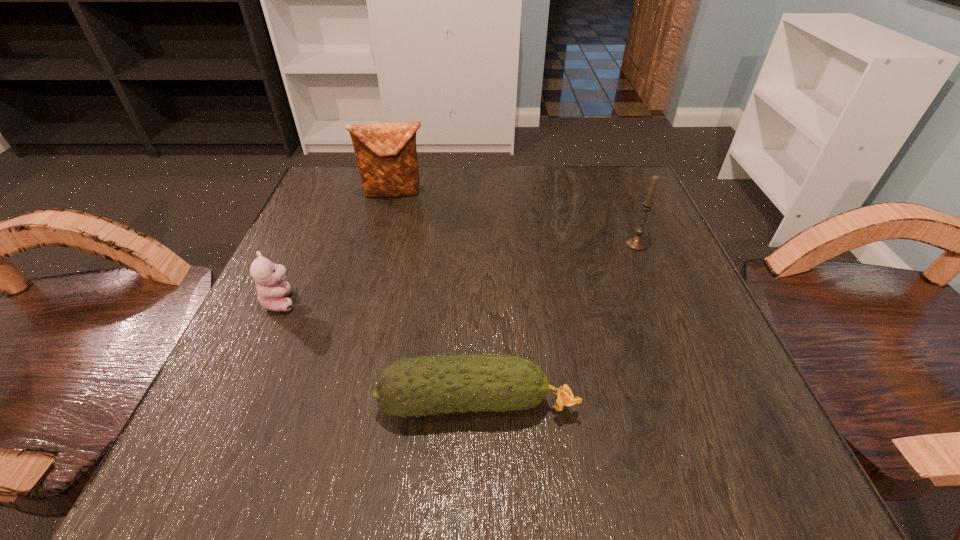
Locate an element on the screen. The width and height of the screenshot is (960, 540). clutch bag is located at coordinates (386, 154).

You are a GUI agent. You are given a task and a screenshot of the screen. Output one action in this format:
    pyautogui.click(x=<x>, y=<y>)
    Task: Click on the candle
    The image size is (960, 540).
    Given the screenshot: What is the action you would take?
    pyautogui.click(x=637, y=242)

Locate an element on the screen. the rightmost object is located at coordinates (637, 242).

Identify the location of the third farthest object. This screenshot has width=960, height=540. (269, 278).

At what (x,y) coordinates should I click in order to perform the action: click on the leftmost object. Please return your answer as a coordinate pair (x, y). Looking at the image, I should click on (269, 278).

Where is `the shortest object`? The width and height of the screenshot is (960, 540). the shortest object is located at coordinates (424, 385).

What are the coordinates of `the nearest object` in the screenshot? It's located at (424, 385).

Identify the location of vacant space located 0.340m on the open side of the farthest object. Image resolution: width=960 pixels, height=540 pixels. (361, 319).

You are a GUI agent. You are given a task and a screenshot of the screen. Output one action in this format:
    pyautogui.click(x=<x>, y=<y>)
    Task: Click on the vacant region located 0.150m on the left of the candle
    The image size is (960, 540).
    Given the screenshot: What is the action you would take?
    pyautogui.click(x=547, y=243)

Find the location of `free point located at the face of the second nearest object`. free point located at the face of the second nearest object is located at coordinates (351, 301).